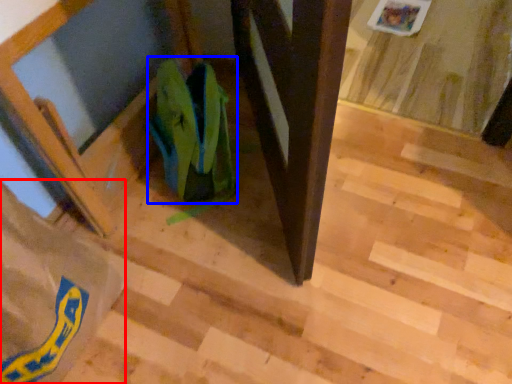
Question: Which object appears farthest to the camera in this image, grocery bag (highlighted by a red box) or grocery bag (highlighted by a blue box)?

Choices:
 (A) grocery bag
 (B) grocery bag

Answer: (B)